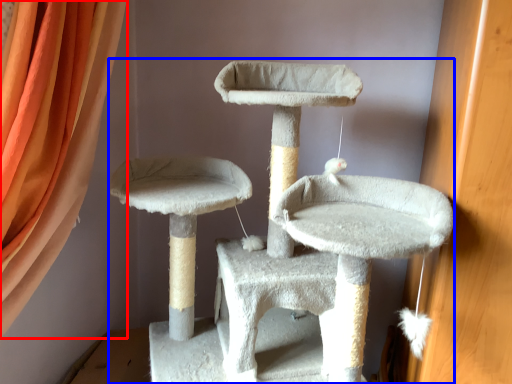
Question: Among these objects, which one is nearest to the camera, curtain (highlighted by a red box) or cat furniture (highlighted by a blue box)?

Choices:
 (A) curtain
 (B) cat furniture

Answer: (B)